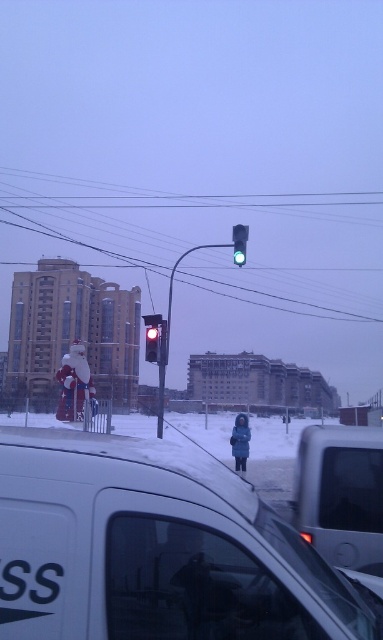
How distant is green glass traffic light at center from red glass traffic light at center?

4.15 meters

Is green glass traffic light at center to the left of red glass traffic light at center from the viewer's perspective?

In fact, green glass traffic light at center is to the right of red glass traffic light at center.

At what (x,y) coordinates should I click in order to perform the action: click on green glass traffic light at center. Please return your answer as a coordinate pair (x, y). Looking at the image, I should click on (240, 243).

Where is `green glass traffic light at center`? green glass traffic light at center is located at coordinates (240, 243).

In the scene shown: Measure the distance from blue matte coat at center to red glass traffic light at center.

They are 4.25 meters apart.

Describe the element at coordinates (240, 442) in the screenshot. I see `blue matte coat at center` at that location.

Where is `blue matte coat at center`? This screenshot has height=640, width=383. blue matte coat at center is located at coordinates (240, 442).

At what (x,y) coordinates should I click in order to perform the action: click on white matte van at lower left. Please return your answer as a coordinate pair (x, y). This screenshot has width=383, height=640. Looking at the image, I should click on (155, 548).

Which is in front, point (309, 584) or point (80, 342)?

Point (309, 584) is in front.

The image size is (383, 640). What are the coordinates of `white matte van at lower left` in the screenshot? It's located at (155, 548).

You are a GUI agent. You are given a task and a screenshot of the screen. Output one action in this format:
    pyautogui.click(x=<x>, y=<y>)
    Task: Click on the white matte van at lower left
    
    Given the screenshot: What is the action you would take?
    pyautogui.click(x=155, y=548)